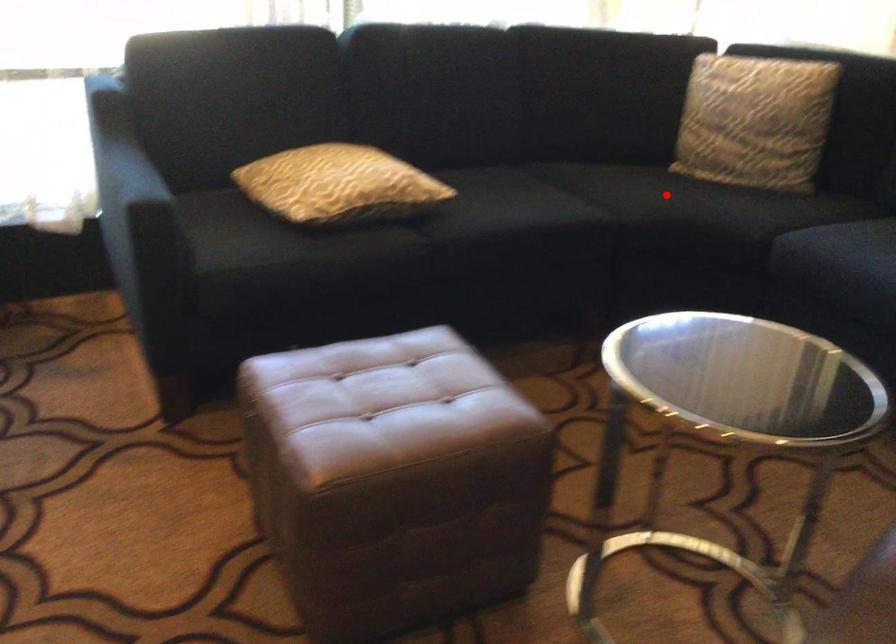
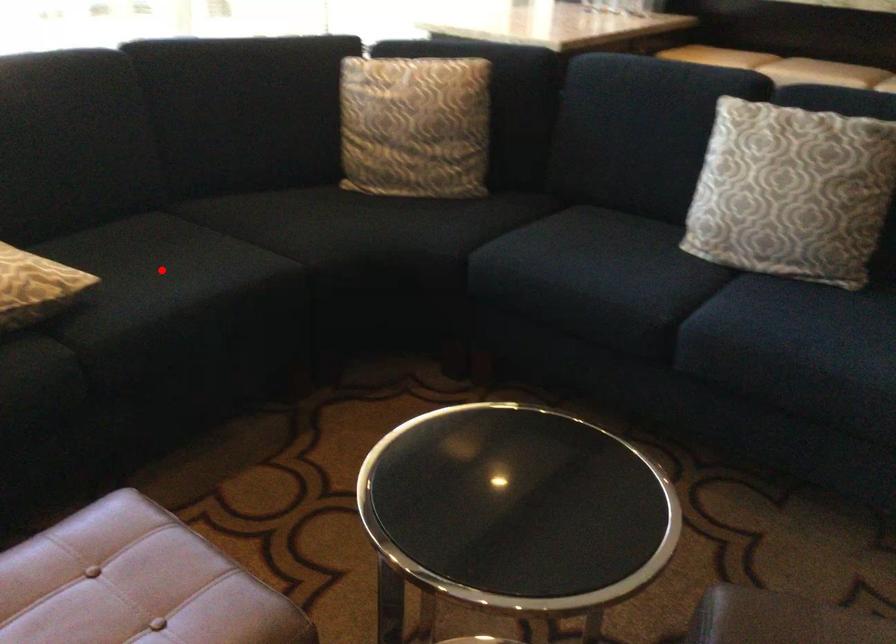
I am providing you with two images of the same scene from different viewpoints. A red point is marked on the first image and another point is marked on the second image. Does the point marked in image1 correspond to the same location as the one in image2?

No